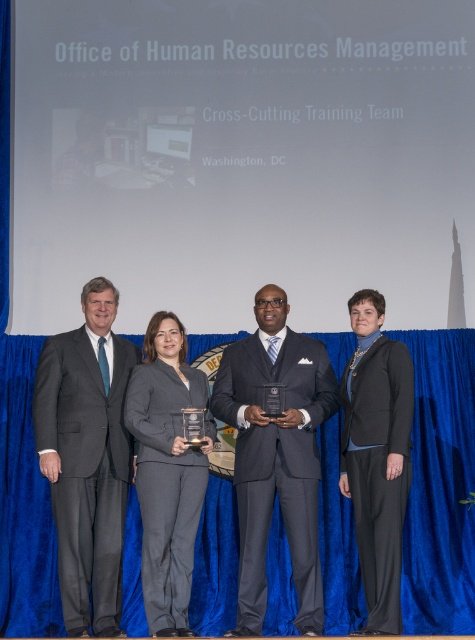
Question: Among these objects, which one is farthest from the camera?

Choices:
 (A) matte black suit at center
 (B) charcoal gray suit at left

Answer: (A)

Question: Is matte black suit at center thinner than gray suit at center?

Choices:
 (A) no
 (B) yes

Answer: (A)

Question: Which point is farther to the camera?

Choices:
 (A) (325, 365)
 (B) (188, 504)
 (C) (65, 460)

Answer: (A)

Question: Can you confirm if matte black suit at center is positioned below gray suit at center?

Choices:
 (A) no
 (B) yes

Answer: (A)

Question: Can you confirm if matte black suit at center is wider than gray suit at center?

Choices:
 (A) yes
 (B) no

Answer: (A)

Question: Among these objects, which one is farthest from the camera?

Choices:
 (A) matte black suit at center
 (B) gray suit at center

Answer: (A)